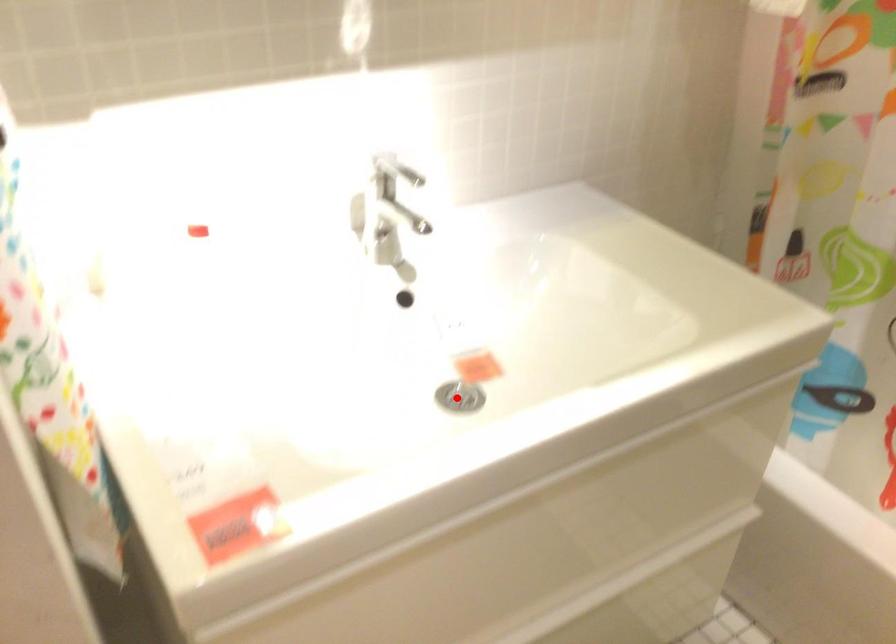
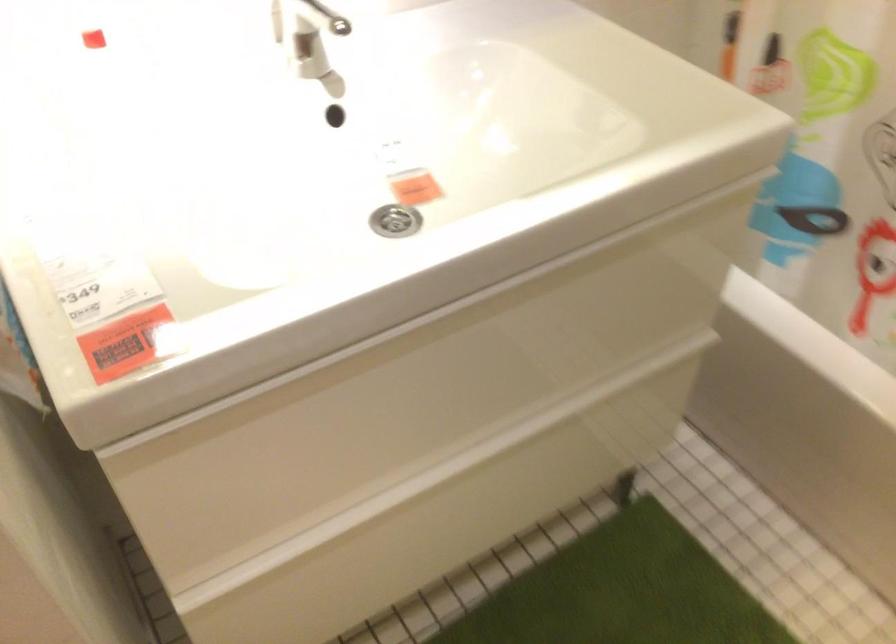
In the second image, find the point that corresponds to the highlighted location in the first image.

(394, 221)